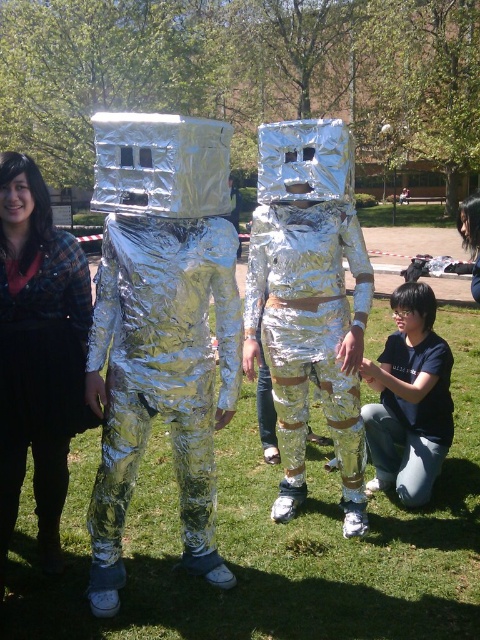
In the scene shown: You are standing in a park and see the brushed metal jacket at upper left. If you want to reach it in 3 seconds, what is the minimum speed you need to move towards it?

The distance between you and the brushed metal jacket at upper left is 2.76 meters. To cover this distance in 3 seconds, you need to move at a minimum speed of 0.92 meters per second.

You are standing at the back of the image and want to take a photo of the shiny metallic suit at center and the black matte shirt at lower right. Which object will be closer to the camera in the photo?

The shiny metallic suit at center is in front of the black matte shirt at lower right, so it will appear closer to the camera in the photo.